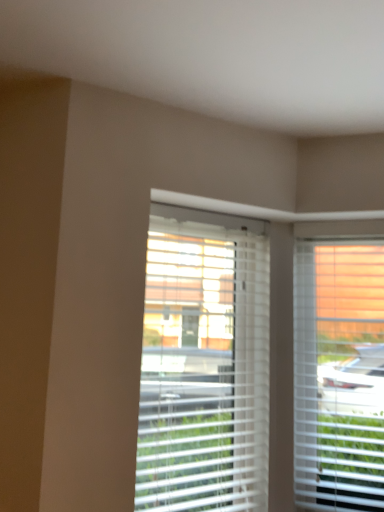
Question: Should I look upward or downward to see white plastic blinds at center?

Choices:
 (A) down
 (B) up

Answer: (A)